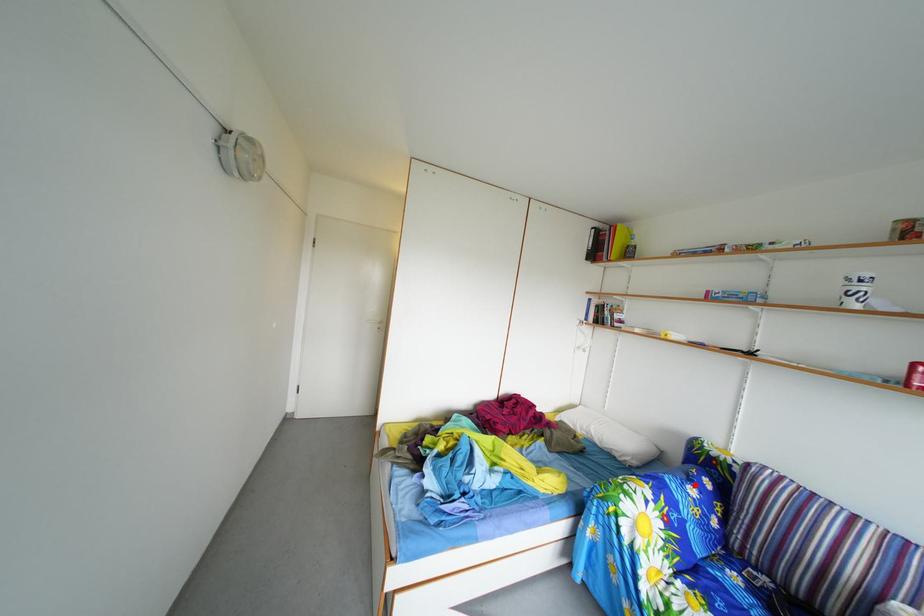
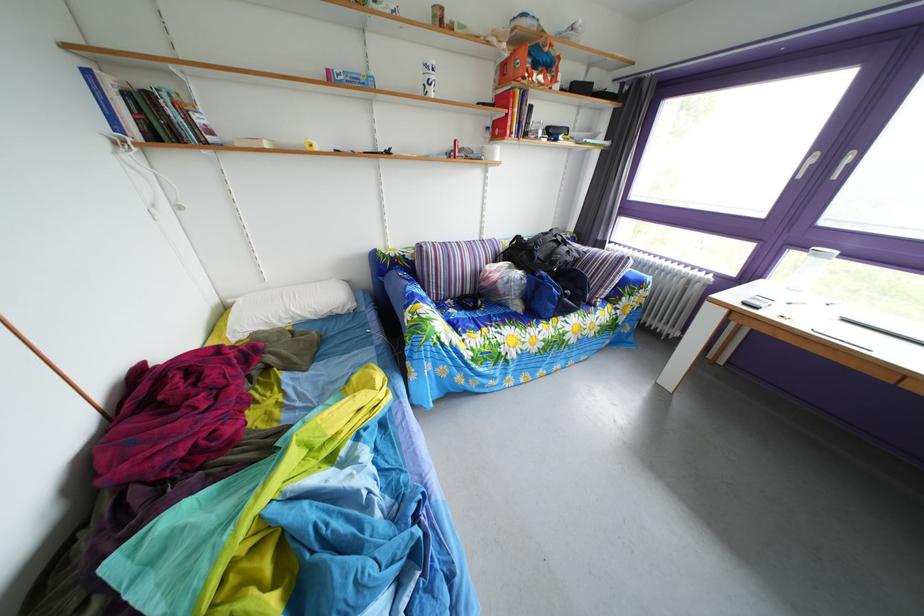
In the second image, find the point that corresponds to the highlighted location in the first image.

(417, 290)